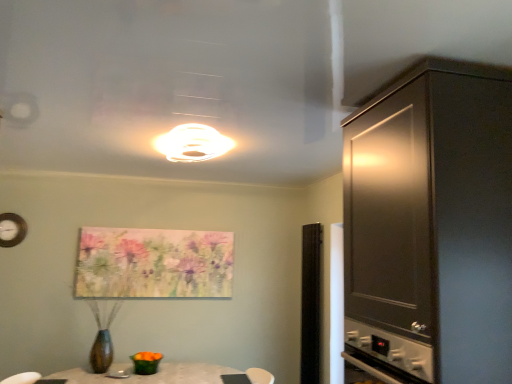
The height and width of the screenshot is (384, 512). What do you see at coordinates (311, 303) in the screenshot? I see `transparent glass door at center` at bounding box center [311, 303].

Describe the element at coordinates (431, 227) in the screenshot. The width and height of the screenshot is (512, 384). I see `dark wood cabinet at right` at that location.

Where is `transparent glass door at center`? This screenshot has height=384, width=512. transparent glass door at center is located at coordinates (311, 303).

Can you see pastel floral canvas at center touching transparent glass door at center?

No.

You are a GUI agent. You are given a task and a screenshot of the screen. Output one action in this format:
    pyautogui.click(x=<x>, y=<y>)
    Task: Click on the glass door on the right side of pastel floral canvas at center
    The image size is (512, 384).
    Given the screenshot: What is the action you would take?
    pyautogui.click(x=311, y=303)

Considering the positions of objects pastel floral canvas at center and transparent glass door at center in the image provided, who is more to the left, pastel floral canvas at center or transparent glass door at center?

pastel floral canvas at center is more to the left.

Does pastel floral canvas at center turn towards transparent glass door at center?

No.

Which is behind, dark wood cabinet at right or pastel floral canvas at center?

Positioned behind is pastel floral canvas at center.

Is pastel floral canvas at center located within dark wood cabinet at right?

No.

From the image's perspective, is dark wood cabinet at right on top of pastel floral canvas at center?

Correct, dark wood cabinet at right appears higher than pastel floral canvas at center in the image.

Is dark wood cabinet at right beside pastel floral canvas at center?

No, dark wood cabinet at right is not making contact with pastel floral canvas at center.

Based on the photo, is white glossy light fixture at upper center far away from pastel floral canvas at center?

Yes, white glossy light fixture at upper center and pastel floral canvas at center are located far from each other.

Which of these two, white glossy light fixture at upper center or pastel floral canvas at center, is wider?

Wider between the two is white glossy light fixture at upper center.

From the picture: Is white glossy light fixture at upper center taller or shorter than pastel floral canvas at center?

Clearly, white glossy light fixture at upper center is shorter compared to pastel floral canvas at center.

Based on the photo, is white glossy light fixture at upper center aimed at pastel floral canvas at center?

No, white glossy light fixture at upper center is not oriented towards pastel floral canvas at center.

I want to click on light fixture that appears above the dark wood cabinet at right (from the image's perspective), so click(193, 143).

In the scene shown: Measure the distance between dark wood cabinet at right and white glossy light fixture at upper center.

A distance of 1.25 meters exists between dark wood cabinet at right and white glossy light fixture at upper center.

Based on the photo, from a real-world perspective, is dark wood cabinet at right above or below white glossy light fixture at upper center?

Clearly, from a real-world perspective, dark wood cabinet at right is below white glossy light fixture at upper center.

Is pastel floral canvas at center to the left of dark wood cabinet at right from the viewer's perspective?

Yes.

I want to click on cabinetry that appears on the right of pastel floral canvas at center, so click(x=431, y=227).

Based on the photo, is pastel floral canvas at center spatially inside dark wood cabinet at right, or outside of it?

pastel floral canvas at center cannot be found inside dark wood cabinet at right.

In the scene shown: Is transparent glass door at center next to dark wood cabinet at right and touching it?

transparent glass door at center and dark wood cabinet at right are not in contact.

Does transparent glass door at center come behind dark wood cabinet at right?

Yes, it is.

What's the angular difference between transparent glass door at center and dark wood cabinet at right's facing directions?

There is a 1.93-degree angle between the facing directions of transparent glass door at center and dark wood cabinet at right.

Considering the sizes of objects transparent glass door at center and dark wood cabinet at right in the image provided, who is shorter, transparent glass door at center or dark wood cabinet at right?

dark wood cabinet at right is shorter.

Considering the sizes of objects transparent glass door at center and pastel floral canvas at center in the image provided, who is taller, transparent glass door at center or pastel floral canvas at center?

transparent glass door at center.

From the picture: Does transparent glass door at center have a greater width compared to pastel floral canvas at center?

Yes, transparent glass door at center is wider than pastel floral canvas at center.

The width and height of the screenshot is (512, 384). Identify the location of glass door below the pastel floral canvas at center (from a real-world perspective). (311, 303).

Is transparent glass door at center inside or outside of pastel floral canvas at center?

transparent glass door at center is located beyond the bounds of pastel floral canvas at center.

Identify the location of glass door below the pastel floral canvas at center (from a real-world perspective). This screenshot has height=384, width=512. (311, 303).

Locate an element on the screen. The height and width of the screenshot is (384, 512). cabinetry on the right side of pastel floral canvas at center is located at coordinates (431, 227).

Based on their spatial positions, is dark wood cabinet at right or transparent glass door at center further from pastel floral canvas at center?

dark wood cabinet at right is further to pastel floral canvas at center.

Considering their positions, is pastel floral canvas at center positioned closer to dark wood cabinet at right than transparent glass door at center?

transparent glass door at center.

Looking at the image, which one is located further to dark wood cabinet at right, transparent glass door at center or white glossy light fixture at upper center?

Among the two, transparent glass door at center is located further to dark wood cabinet at right.

Looking at the image, which one is located closer to transparent glass door at center, dark wood cabinet at right or pastel floral canvas at center?

The object closer to transparent glass door at center is pastel floral canvas at center.

When comparing their distances from white glossy light fixture at upper center, does transparent glass door at center or dark wood cabinet at right seem further?

Based on the image, transparent glass door at center appears to be further to white glossy light fixture at upper center.

Considering their positions, is dark wood cabinet at right positioned closer to white glossy light fixture at upper center than transparent glass door at center?

The object closer to white glossy light fixture at upper center is dark wood cabinet at right.

Based on their spatial positions, is transparent glass door at center or dark wood cabinet at right closer to pastel floral canvas at center?

transparent glass door at center.

Looking at the image, which one is located further to pastel floral canvas at center, white glossy light fixture at upper center or dark wood cabinet at right?

Among the two, dark wood cabinet at right is located further to pastel floral canvas at center.

Locate an element on the screen. This screenshot has height=384, width=512. light fixture between dark wood cabinet at right and pastel floral canvas at center from front to back is located at coordinates (193, 143).

Where is `light fixture positioned between dark wood cabinet at right and transparent glass door at center from near to far`? The image size is (512, 384). light fixture positioned between dark wood cabinet at right and transparent glass door at center from near to far is located at coordinates (193, 143).

Find the location of a particular element. light fixture between pastel floral canvas at center and transparent glass door at center in the horizontal direction is located at coordinates (193, 143).

At what (x,y) coordinates should I click in order to perform the action: click on glass door positioned between dark wood cabinet at right and pastel floral canvas at center from near to far. Please return your answer as a coordinate pair (x, y). The height and width of the screenshot is (384, 512). Looking at the image, I should click on (311, 303).